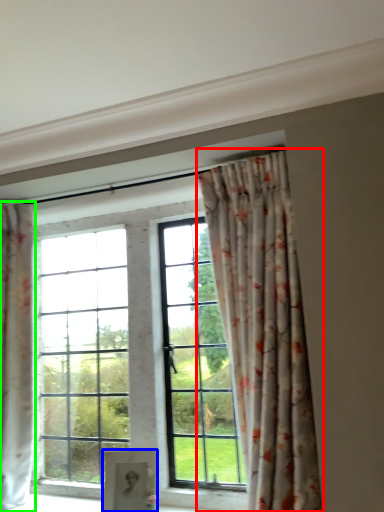
Question: Which object is the closest to the curtain (highlighted by a red box)? Choose among these: furniture (highlighted by a blue box) or curtain (highlighted by a green box).

Choices:
 (A) furniture
 (B) curtain

Answer: (A)